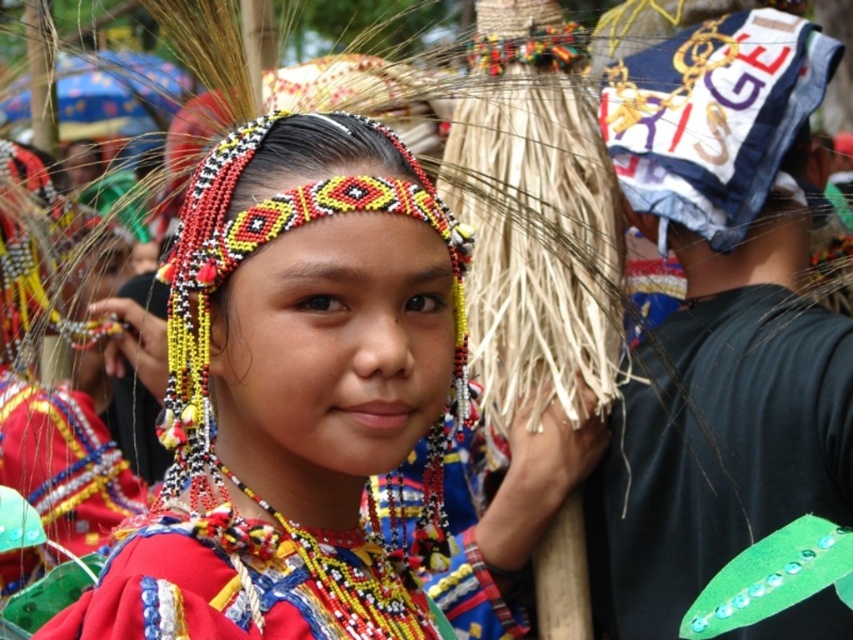
You are an attendee at this festival and want to take a photo of the central figure. The green beaded leaf at right and the beaded fabric necklace at center are both in your viewfinder. Since you want to focus on the taller object, which one should you center your camera on?

The green beaded leaf at right is taller than the beaded fabric necklace at center, so you should center your camera on the green beaded leaf at right to focus on the taller object.